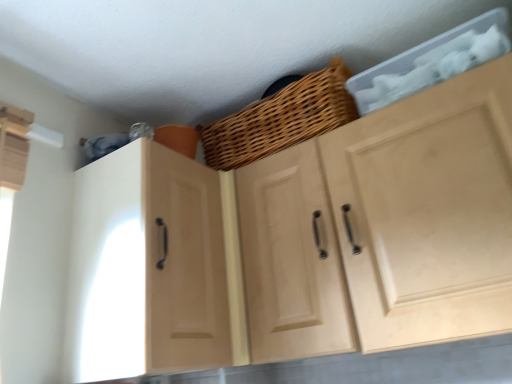
Where is `woven wood basket at upper center`? woven wood basket at upper center is located at coordinates (281, 118).

Does point (244, 119) appear closer or farther from the camera than point (373, 257)?

Point (244, 119) is positioned farther from the camera compared to point (373, 257).

Between woven wood basket at upper center and natural wood cabinet at upper center, the 2th cabinetry viewed from the left, which one has smaller size?

woven wood basket at upper center.

Based on the photo, between woven wood basket at upper center and natural wood cabinet at upper center, marked as the 1th cabinetry in a right-to-left arrangement, which one has less height?

woven wood basket at upper center is shorter.

Which object is positioned more to the left, natural wood cabinet at upper center, marked as the 1th cabinetry in a right-to-left arrangement, or woven wood basket at upper center?

woven wood basket at upper center is more to the left.

Would you consider natural wood cabinet at upper center, marked as the 1th cabinetry in a right-to-left arrangement, to be distant from woven wood basket at upper center?

natural wood cabinet at upper center, marked as the 1th cabinetry in a right-to-left arrangement, is actually quite close to woven wood basket at upper center.

Would you say natural wood cabinet at upper center, the 2th cabinetry viewed from the left, is outside woven wood basket at upper center?

Indeed, natural wood cabinet at upper center, the 2th cabinetry viewed from the left, is completely outside woven wood basket at upper center.

From the picture: Is natural wood cabinet at upper center, marked as the 1th cabinetry in a right-to-left arrangement, aimed at woven wood basket at upper center?

No.

In the scene shown: Is woven wood basket at upper center positioned with its back to matte wood cabinet at left, the second cabinetry viewed from the right?

No.

Could you measure the distance between woven wood basket at upper center and matte wood cabinet at left, positioned as the first cabinetry in left-to-right order?

woven wood basket at upper center and matte wood cabinet at left, positioned as the first cabinetry in left-to-right order, are 15.69 inches apart.

Which is in front, point (277, 90) or point (80, 288)?

The point (80, 288) is closer.

Is woven wood basket at upper center spatially inside matte wood cabinet at left, positioned as the first cabinetry in left-to-right order, or outside of it?

woven wood basket at upper center is outside matte wood cabinet at left, positioned as the first cabinetry in left-to-right order.

Image resolution: width=512 pixels, height=384 pixels. Find the location of `cabinetry on the left of natural wood cabinet at upper center, the 2th cabinetry viewed from the left`. cabinetry on the left of natural wood cabinet at upper center, the 2th cabinetry viewed from the left is located at coordinates (146, 267).

Does natural wood cabinet at upper center, the 2th cabinetry viewed from the left, lie in front of matte wood cabinet at left, positioned as the first cabinetry in left-to-right order?

Yes, natural wood cabinet at upper center, the 2th cabinetry viewed from the left, is closer to the camera.

Which is more to the right, natural wood cabinet at upper center, the 2th cabinetry viewed from the left, or matte wood cabinet at left, positioned as the first cabinetry in left-to-right order?

From the viewer's perspective, natural wood cabinet at upper center, the 2th cabinetry viewed from the left, appears more on the right side.

From the image's perspective, is matte wood cabinet at left, the second cabinetry viewed from the right, located above natural wood cabinet at upper center, the 2th cabinetry viewed from the left?

Incorrect, from the image's perspective, matte wood cabinet at left, the second cabinetry viewed from the right, is lower than natural wood cabinet at upper center, the 2th cabinetry viewed from the left.

Is matte wood cabinet at left, positioned as the first cabinetry in left-to-right order, positioned beyond the bounds of natural wood cabinet at upper center, the 2th cabinetry viewed from the left?

Absolutely, matte wood cabinet at left, positioned as the first cabinetry in left-to-right order, is external to natural wood cabinet at upper center, the 2th cabinetry viewed from the left.

Does point (121, 152) come behind point (396, 244)?

Yes, point (121, 152) is behind point (396, 244).

Is matte wood cabinet at left, positioned as the first cabinetry in left-to-right order, facing away from natural wood cabinet at upper center, marked as the 1th cabinetry in a right-to-left arrangement?

No, natural wood cabinet at upper center, marked as the 1th cabinetry in a right-to-left arrangement, is not at the back of matte wood cabinet at left, positioned as the first cabinetry in left-to-right order.

Is matte wood cabinet at left, positioned as the first cabinetry in left-to-right order, wider than woven wood basket at upper center?

Correct, the width of matte wood cabinet at left, positioned as the first cabinetry in left-to-right order, exceeds that of woven wood basket at upper center.

Does matte wood cabinet at left, positioned as the first cabinetry in left-to-right order, touch woven wood basket at upper center?

There is a gap between matte wood cabinet at left, positioned as the first cabinetry in left-to-right order, and woven wood basket at upper center.

From the image's perspective, who appears lower, matte wood cabinet at left, positioned as the first cabinetry in left-to-right order, or woven wood basket at upper center?

matte wood cabinet at left, positioned as the first cabinetry in left-to-right order, from the image's perspective.

Can you tell me how much matte wood cabinet at left, positioned as the first cabinetry in left-to-right order, and woven wood basket at upper center differ in facing direction?

The angular difference between matte wood cabinet at left, positioned as the first cabinetry in left-to-right order, and woven wood basket at upper center is 95.8 degrees.

From the image's perspective, count 1st cabinetrys downward from the woven wood basket at upper center and point to it. Please provide its 2D coordinates.

[(385, 226)]

Starting from the woven wood basket at upper center, which cabinetry is the 2nd one in front? Please provide its 2D coordinates.

[(385, 226)]

Based on their spatial positions, is natural wood cabinet at upper center, marked as the 1th cabinetry in a right-to-left arrangement, or woven wood basket at upper center closer to matte wood cabinet at left, the second cabinetry viewed from the right?

The object closer to matte wood cabinet at left, the second cabinetry viewed from the right, is natural wood cabinet at upper center, marked as the 1th cabinetry in a right-to-left arrangement.

Based on their spatial positions, is matte wood cabinet at left, positioned as the first cabinetry in left-to-right order, or natural wood cabinet at upper center, the 2th cabinetry viewed from the left, further from woven wood basket at upper center?

matte wood cabinet at left, positioned as the first cabinetry in left-to-right order, is further to woven wood basket at upper center.

Based on their spatial positions, is matte wood cabinet at left, the second cabinetry viewed from the right, or woven wood basket at upper center further from natural wood cabinet at upper center, marked as the 1th cabinetry in a right-to-left arrangement?

matte wood cabinet at left, the second cabinetry viewed from the right, is further to natural wood cabinet at upper center, marked as the 1th cabinetry in a right-to-left arrangement.

Based on their spatial positions, is natural wood cabinet at upper center, marked as the 1th cabinetry in a right-to-left arrangement, or matte wood cabinet at left, positioned as the first cabinetry in left-to-right order, further from woven wood basket at upper center?

matte wood cabinet at left, positioned as the first cabinetry in left-to-right order.

Considering their positions, is woven wood basket at upper center positioned further to natural wood cabinet at upper center, marked as the 1th cabinetry in a right-to-left arrangement, than matte wood cabinet at left, the second cabinetry viewed from the right?

matte wood cabinet at left, the second cabinetry viewed from the right, is positioned further to the anchor natural wood cabinet at upper center, marked as the 1th cabinetry in a right-to-left arrangement.

When comparing their distances from matte wood cabinet at left, positioned as the first cabinetry in left-to-right order, does woven wood basket at upper center or natural wood cabinet at upper center, the 2th cabinetry viewed from the left, seem closer?

The object closer to matte wood cabinet at left, positioned as the first cabinetry in left-to-right order, is natural wood cabinet at upper center, the 2th cabinetry viewed from the left.

Locate an element on the screen. basket between matte wood cabinet at left, the second cabinetry viewed from the right, and natural wood cabinet at upper center, marked as the 1th cabinetry in a right-to-left arrangement, in the horizontal direction is located at coordinates (281, 118).